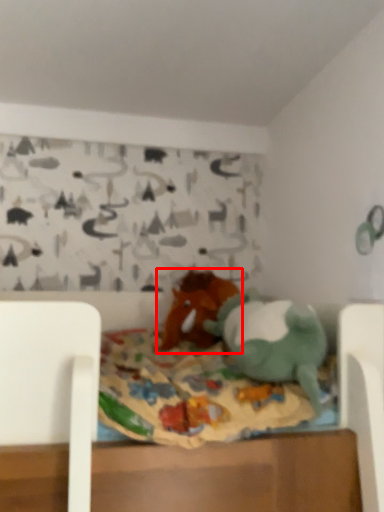
Question: From the image's perspective, where is toy (annotated by the red box) located relative to toy?

Choices:
 (A) above
 (B) below

Answer: (A)